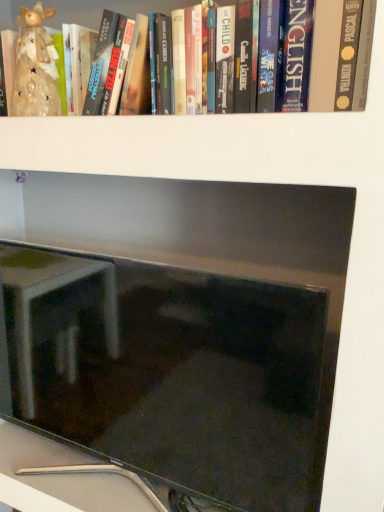
Locate an element on the screen. The width and height of the screenshot is (384, 512). free spot below matte black monitor at center (from a real-world perspective) is located at coordinates (70, 477).